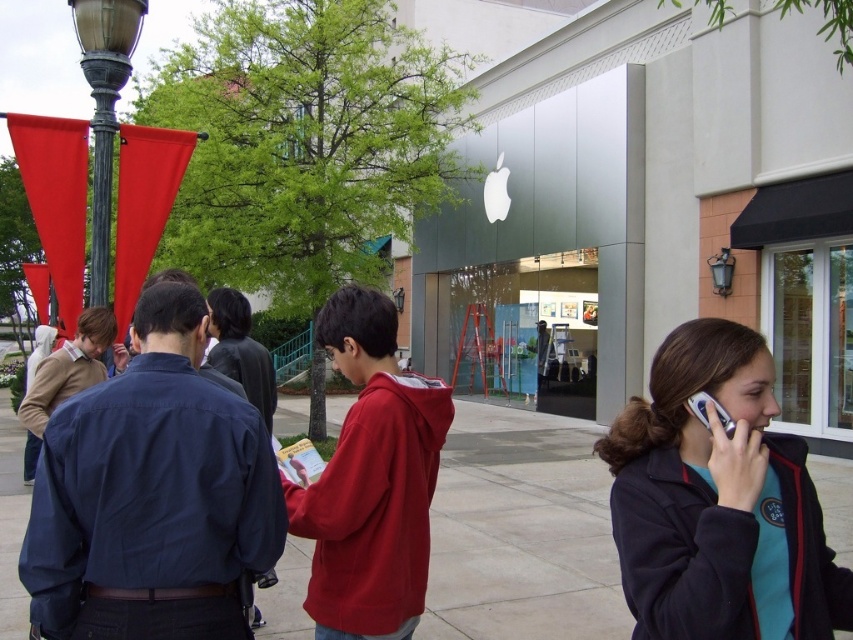
Question: In this image, where is teal fleece jacket at lower right located relative to bronze lamp post at upper left?

Choices:
 (A) left
 (B) right

Answer: (B)

Question: Among these points, which one is farthest from the camera?

Choices:
 (A) (126, 54)
 (B) (695, 406)

Answer: (A)

Question: Among these objects, which one is nearest to the camera?

Choices:
 (A) teal fleece jacket at lower right
 (B) bronze lamp post at upper left

Answer: (A)

Question: Estimate the real-world distances between objects in this image. Which object is closer to the silver metallic phone at right?

Choices:
 (A) smooth concrete pavement at center
 (B) bronze lamp post at upper left

Answer: (B)

Question: In this image, where is bronze lamp post at upper left located relative to silver metallic phone at right?

Choices:
 (A) left
 (B) right

Answer: (A)

Question: Can you confirm if smooth concrete pavement at center is positioned to the right of teal fleece jacket at lower right?

Choices:
 (A) yes
 (B) no

Answer: (B)